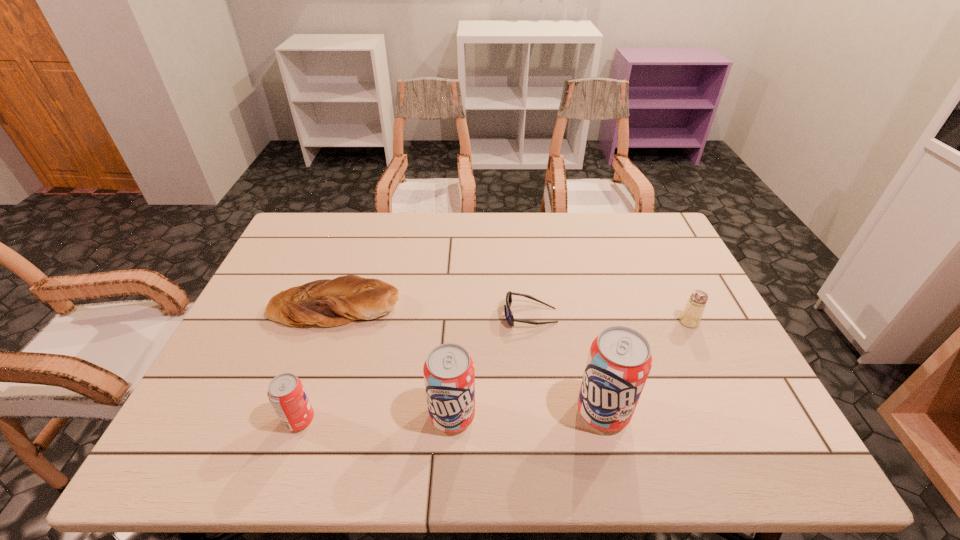
This screenshot has height=540, width=960. I want to click on vacant area that lies between the fourth object from left to right and the second shortest object, so click(x=433, y=311).

Find the location of a particular element. vacant space that is in between the sunglasses and the fifth object from left to right is located at coordinates (566, 364).

Locate an element on the screen. vacant point located between the fourth shortest object and the sunglasses is located at coordinates (415, 368).

Identify the location of free space that is in between the fifth object from left to right and the fourth object from left to right. (566, 364).

Locate an element on the screen. The image size is (960, 540). free space that is in between the fourth shortest object and the sunglasses is located at coordinates (415, 368).

Locate an element on the screen. free space that is in between the second shortest soda can and the second object from right to left is located at coordinates (528, 414).

Identify the location of the third closest object relative to the second soda can from left to right. (325, 302).

The width and height of the screenshot is (960, 540). What are the coordinates of `the third closest object to the fifth object from left to right` in the screenshot? It's located at (691, 315).

Identify which soda can is the nearest to the fourth tallest object. Please provide its 2D coordinates. Your answer should be formatted as a tuple, i.e. [(x, y)], where the tuple contains the x and y coordinates of a point satisfying the conditions above.

[(619, 361)]

Locate which soda can ranks in proximity to the rightmost soda can. Please provide its 2D coordinates. Your answer should be formatted as a tuple, i.e. [(x, y)], where the tuple contains the x and y coordinates of a point satisfying the conditions above.

[(449, 374)]